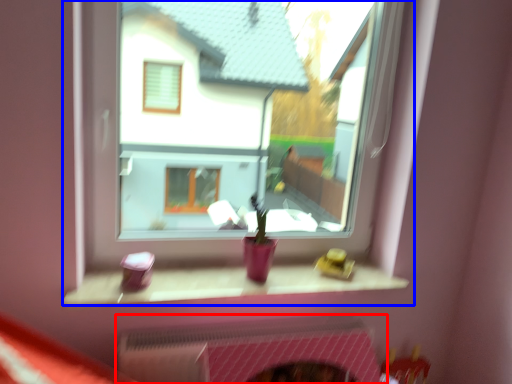
Question: Which of the following is the closest to the observer, fireplace (highlighted by a red box) or window (highlighted by a blue box)?

Choices:
 (A) fireplace
 (B) window

Answer: (B)